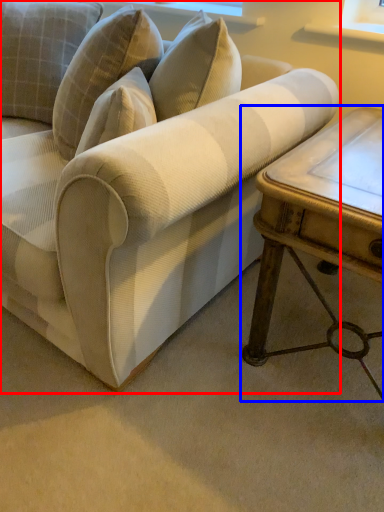
Question: Which object is further to the camera taking this photo, studio couch (highlighted by a red box) or table (highlighted by a blue box)?

Choices:
 (A) studio couch
 (B) table

Answer: (B)